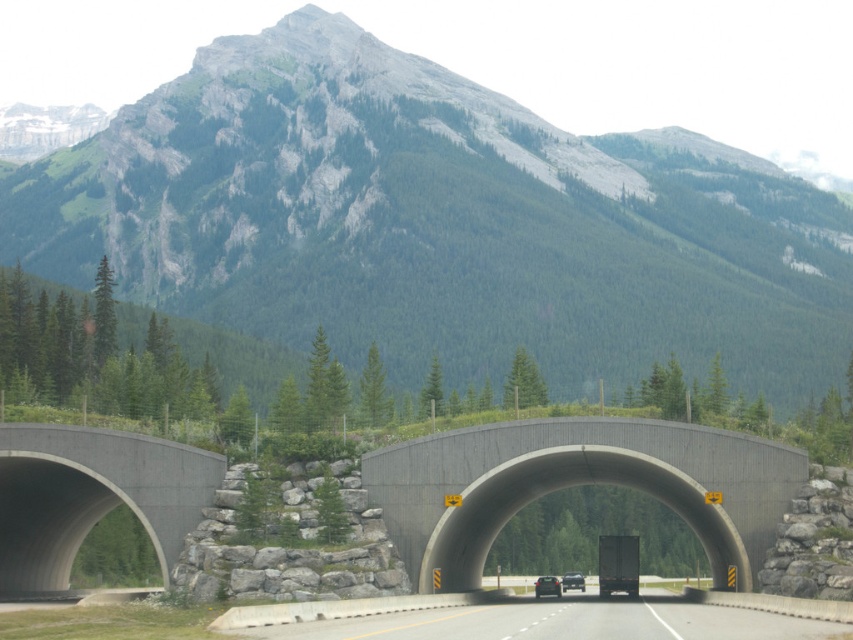
What do you see at coordinates (436, 221) in the screenshot? This screenshot has width=853, height=640. I see `green rock mountain at upper center` at bounding box center [436, 221].

Does point (239, 76) lie behind point (547, 595)?

That is True.

At what (x,y) coordinates should I click in order to perform the action: click on green rock mountain at upper center. Please return your answer as a coordinate pair (x, y). This screenshot has height=640, width=853. Looking at the image, I should click on (436, 221).

You are a GUI agent. You are given a task and a screenshot of the screen. Output one action in this format:
    pyautogui.click(x=<x>, y=<y>)
    Task: Click on the green rock mountain at upper center
    The height and width of the screenshot is (640, 853).
    Given the screenshot: What is the action you would take?
    pyautogui.click(x=436, y=221)

Can you confirm if green rock mountain at upper center is positioned above gray concrete tunnel at left?

Yes.

This screenshot has width=853, height=640. Identify the location of green rock mountain at upper center. (436, 221).

Is point (479, 166) more distant than point (7, 577)?

Yes, point (479, 166) is farther from viewer.

Identify the location of green rock mountain at upper center. The image size is (853, 640). (436, 221).

Is point (753, 481) less distant than point (93, 488)?

Yes, point (753, 481) is closer to viewer.

Which is below, gray concrete overpass at center or gray concrete tunnel at left?

Positioned lower is gray concrete tunnel at left.

At what (x,y) coordinates should I click in order to perform the action: click on gray concrete overpass at center. Please return your answer as a coordinate pair (x, y). The image size is (853, 640). Looking at the image, I should click on (577, 484).